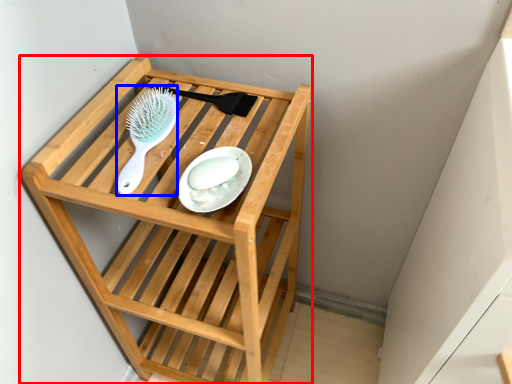
Question: Which point is further to the camera, furniture (highlighted by a red box) or brush (highlighted by a blue box)?

Choices:
 (A) furniture
 (B) brush

Answer: (B)